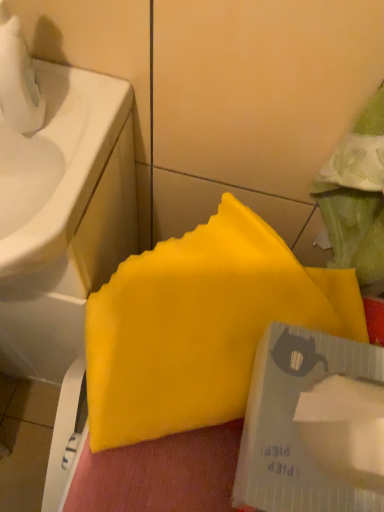
Question: Is transparent plastic tape at lower right further to the viewer compared to yellow matte paper at center?

Choices:
 (A) no
 (B) yes

Answer: (A)

Question: From the image's perspective, is transparent plastic tape at lower right beneath yellow matte paper at center?

Choices:
 (A) yes
 (B) no

Answer: (A)

Question: Is transparent plastic tape at lower right wider than yellow matte paper at center?

Choices:
 (A) no
 (B) yes

Answer: (A)

Question: Considering the relative sizes of transparent plastic tape at lower right and yellow matte paper at center in the image provided, is transparent plastic tape at lower right taller than yellow matte paper at center?

Choices:
 (A) no
 (B) yes

Answer: (B)

Question: Is transparent plastic tape at lower right at the left side of yellow matte paper at center?

Choices:
 (A) no
 (B) yes

Answer: (A)

Question: Is transparent plastic tape at lower right not within yellow matte paper at center?

Choices:
 (A) no
 (B) yes

Answer: (B)

Question: Is transparent plastic tape at lower right at the right side of white glossy sink at left?

Choices:
 (A) no
 (B) yes

Answer: (B)

Question: Are transparent plastic tape at lower right and white glossy sink at left far apart?

Choices:
 (A) no
 (B) yes

Answer: (A)

Question: From the image's perspective, is transparent plastic tape at lower right under white glossy sink at left?

Choices:
 (A) no
 (B) yes

Answer: (B)

Question: Does transparent plastic tape at lower right appear on the left side of white glossy sink at left?

Choices:
 (A) no
 (B) yes

Answer: (A)

Question: From a real-world perspective, is transparent plastic tape at lower right over white glossy sink at left?

Choices:
 (A) no
 (B) yes

Answer: (B)

Question: Is transparent plastic tape at lower right turned away from white glossy sink at left?

Choices:
 (A) no
 (B) yes

Answer: (A)

Question: Does white glossy sink at left turn towards yellow matte paper at center?

Choices:
 (A) yes
 (B) no

Answer: (B)